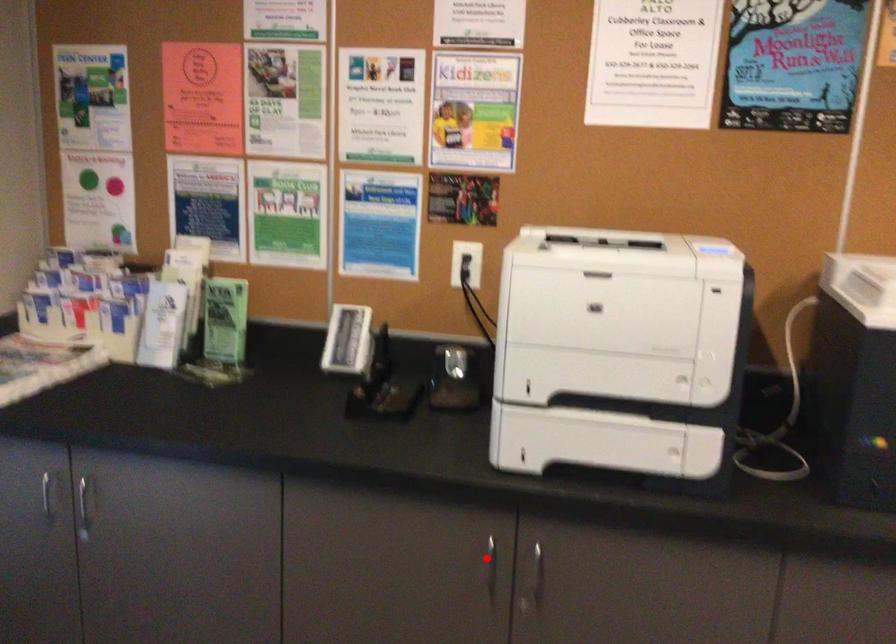
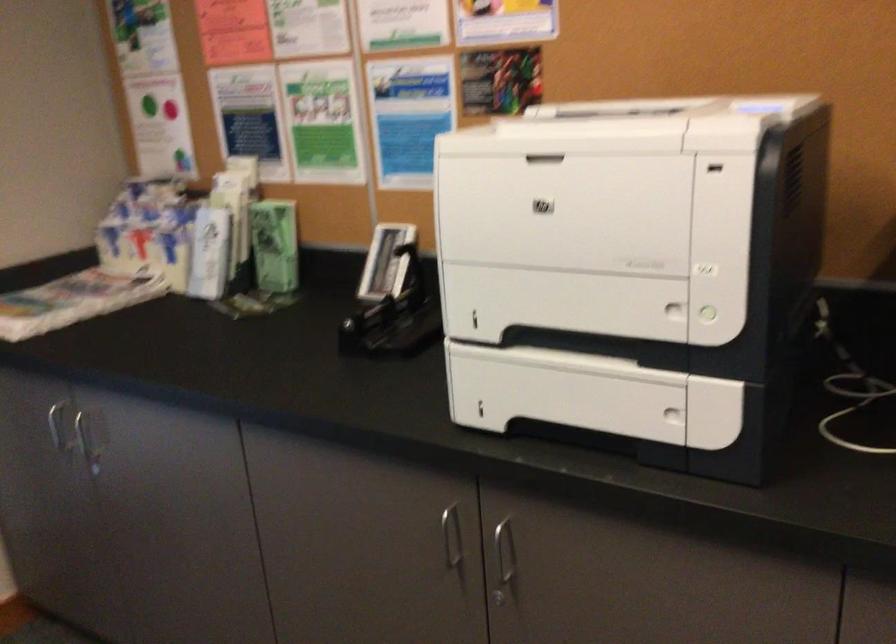
Question: A red point is marked in image1. In image2, is the corresponding 3D point closer to the camera or farther? Reply with the corresponding letter.

Choices:
 (A) The corresponding 3D point is closer.
 (B) The corresponding 3D point is farther.

Answer: (A)